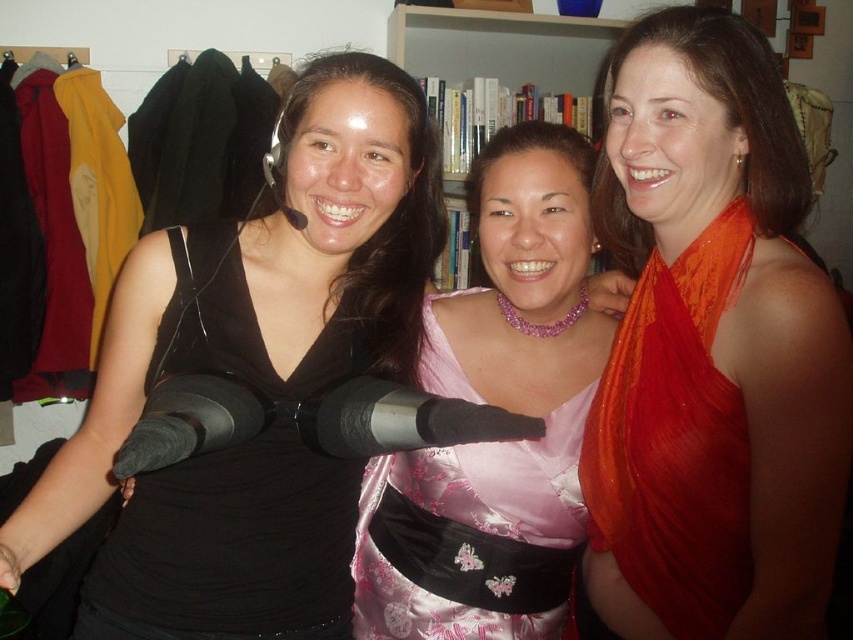
Can you confirm if orange silk scarf at upper right is bigger than black satin dress at left?

Indeed, orange silk scarf at upper right has a larger size compared to black satin dress at left.

Can you confirm if orange silk scarf at upper right is taller than black satin dress at left?

Yes.

Does point (601, 509) come closer to viewer compared to point (213, 451)?

No, it is not.

Where is `orange silk scarf at upper right`? The height and width of the screenshot is (640, 853). orange silk scarf at upper right is located at coordinates (712, 349).

Describe the element at coordinates (712, 349) in the screenshot. The image size is (853, 640). I see `orange silk scarf at upper right` at that location.

Between point (639, 506) and point (457, 45), which one is positioned behind?

Positioned behind is point (457, 45).

I want to click on orange silk scarf at upper right, so click(x=712, y=349).

Image resolution: width=853 pixels, height=640 pixels. What do you see at coordinates (235, 544) in the screenshot?
I see `black satin dress at left` at bounding box center [235, 544].

Is black satin dress at left positioned in front of hardcover books at center?

Yes, black satin dress at left is closer to the viewer.

Is point (270, 444) farther from camera compared to point (461, 45)?

No, it is in front of (461, 45).

Where is `black satin dress at left`? black satin dress at left is located at coordinates (235, 544).